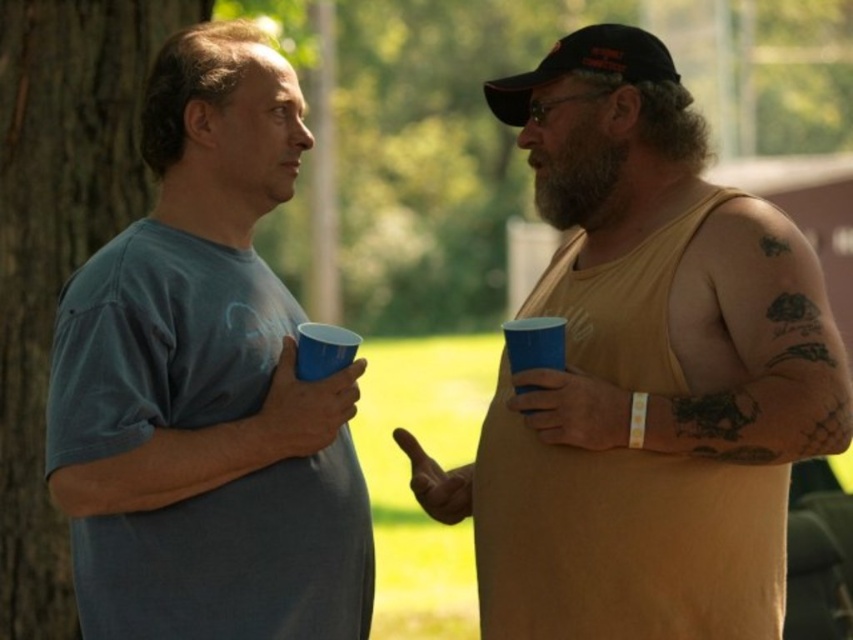
Is matte yellow tank top at right taller than black fabric baseball cap at upper right?

Yes.

Which is in front, point (608, 193) or point (560, 68)?

Point (608, 193) is in front.

This screenshot has width=853, height=640. Identify the location of matte yellow tank top at right. (643, 374).

How much distance is there between matte yellow tank top at right and brown rough bark at left?

matte yellow tank top at right and brown rough bark at left are 1.22 meters apart.

In the scene shown: Can you confirm if matte yellow tank top at right is shorter than brown rough bark at left?

Yes.

Measure the distance between matte yellow tank top at right and camera.

matte yellow tank top at right is 2.98 meters away from camera.

You are a GUI agent. You are given a task and a screenshot of the screen. Output one action in this format:
    pyautogui.click(x=<x>, y=<y>)
    Task: Click on the matte yellow tank top at right
    
    Given the screenshot: What is the action you would take?
    pyautogui.click(x=643, y=374)

Can you confirm if matte yellow tank top at right is positioned to the left of matte blue t-shirt at left?

Incorrect, matte yellow tank top at right is not on the left side of matte blue t-shirt at left.

Based on the photo, between matte yellow tank top at right and matte blue t-shirt at left, which one is positioned higher?

matte blue t-shirt at left is higher up.

Is point (640, 384) behind point (82, 477)?

Yes.

You are a GUI agent. You are given a task and a screenshot of the screen. Output one action in this format:
    pyautogui.click(x=<x>, y=<y>)
    Task: Click on the matte yellow tank top at right
    The image size is (853, 640).
    Given the screenshot: What is the action you would take?
    pyautogui.click(x=643, y=374)